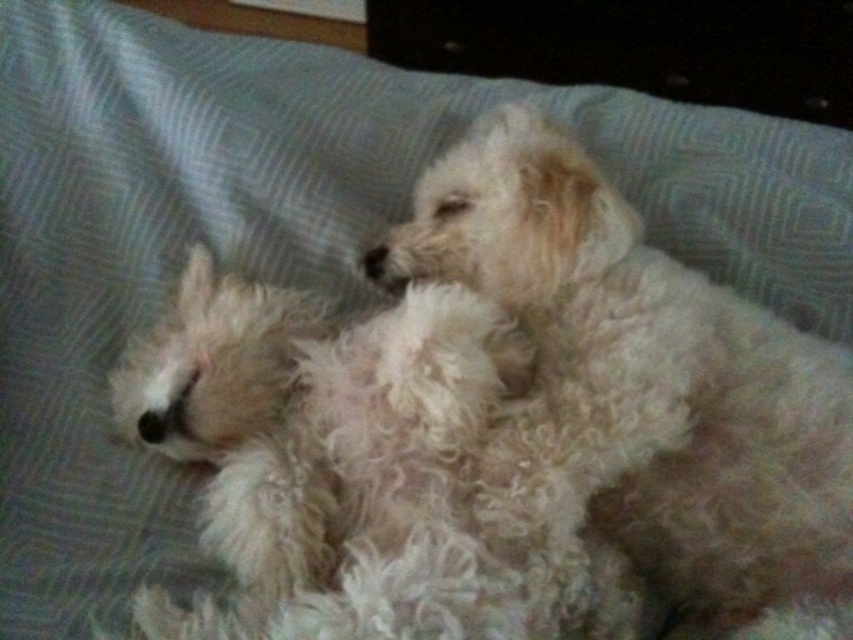
Question: Which point is closer to the camera?

Choices:
 (A) fluffy white dog at center
 (B) white fluffy dog at center

Answer: (B)

Question: Is fluffy white dog at center to the right of white fluffy dog at center from the viewer's perspective?

Choices:
 (A) yes
 (B) no

Answer: (A)

Question: In this image, where is fluffy white dog at center located relative to white fluffy dog at center?

Choices:
 (A) right
 (B) left

Answer: (A)

Question: Among these objects, which one is nearest to the camera?

Choices:
 (A) white fluffy dog at center
 (B) fluffy white dog at center

Answer: (A)

Question: Is fluffy white dog at center below white fluffy dog at center?

Choices:
 (A) yes
 (B) no

Answer: (B)